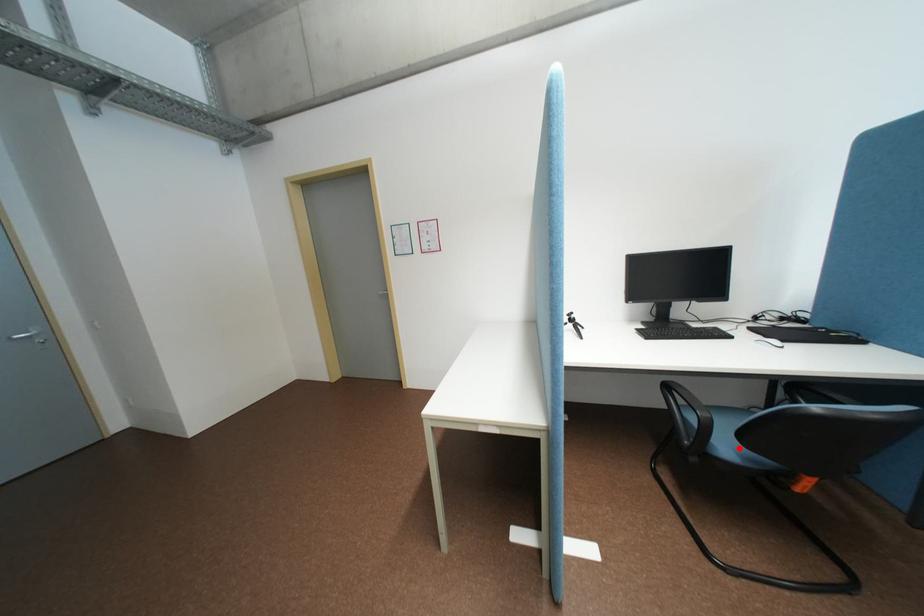
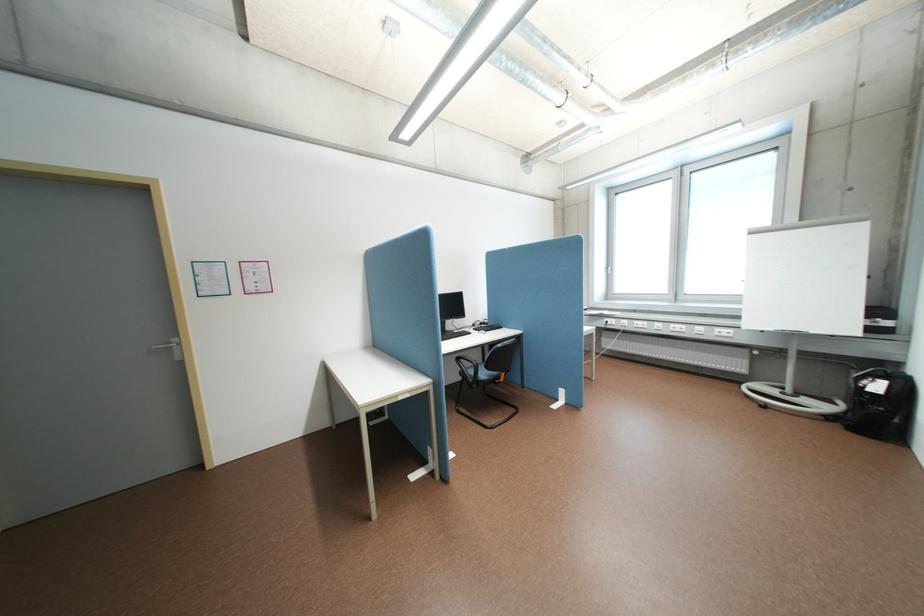
Question: I am providing you with two images of the same scene from different viewpoints. Image1 has a red point marked. In image2, the corresponding 3D location appears at what relative position? Reply with the corresponding letter.

Choices:
 (A) Closer
 (B) Farther

Answer: (A)